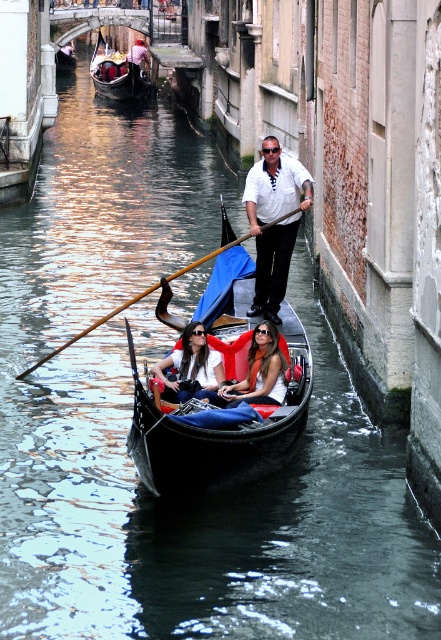
You are a tourist in Venice and want to take a photo of the gondolier. You have a camera with a zoom lens. The white striped shirt at center and matte black sunglasses at center are both in the frame. Which object should you focus on to ensure the gondolier is in sharp focus?

You should focus on the white striped shirt at center because it is positioned over the matte black sunglasses at center, meaning it is closer to the camera. Focusing on the closer object will ensure the gondolier is in sharp focus.

You are standing on a bridge overlooking the canal and want to know how far the point at coordinates point [269,260] is from you. Can you determine the distance?

The distance between point [269,260] and the viewer is 21.48 meters.